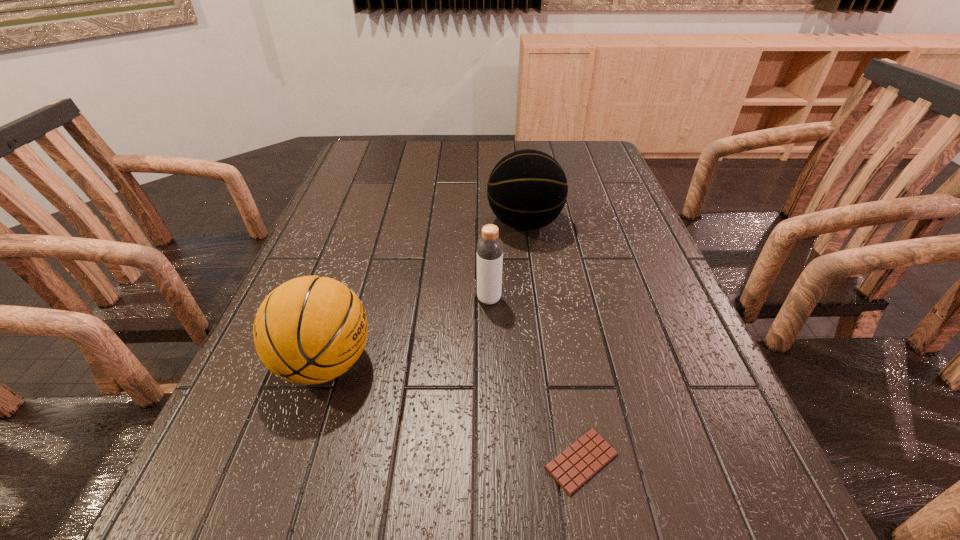
This screenshot has width=960, height=540. In order to click on the farther basketball in this screenshot , I will do `click(527, 189)`.

This screenshot has height=540, width=960. I want to click on the right basketball, so tap(527, 189).

Where is `bottle`? This screenshot has height=540, width=960. bottle is located at coordinates (489, 247).

This screenshot has width=960, height=540. I want to click on the third farthest object, so click(x=309, y=330).

Find the location of `the nearer basketball`. the nearer basketball is located at coordinates pyautogui.click(x=309, y=330).

Identify the location of candy bar. (573, 467).

Find the location of a particular element. the shortest object is located at coordinates (573, 467).

Locate an element on the screen. Image resolution: width=960 pixels, height=540 pixels. free location located on the back of the farthest object is located at coordinates (517, 172).

Where is `vacant space located on the front of the second farthest object`? This screenshot has height=540, width=960. vacant space located on the front of the second farthest object is located at coordinates (492, 392).

Identify the location of free location located on the surface of the nearer basketball near the brand logo. (518, 363).